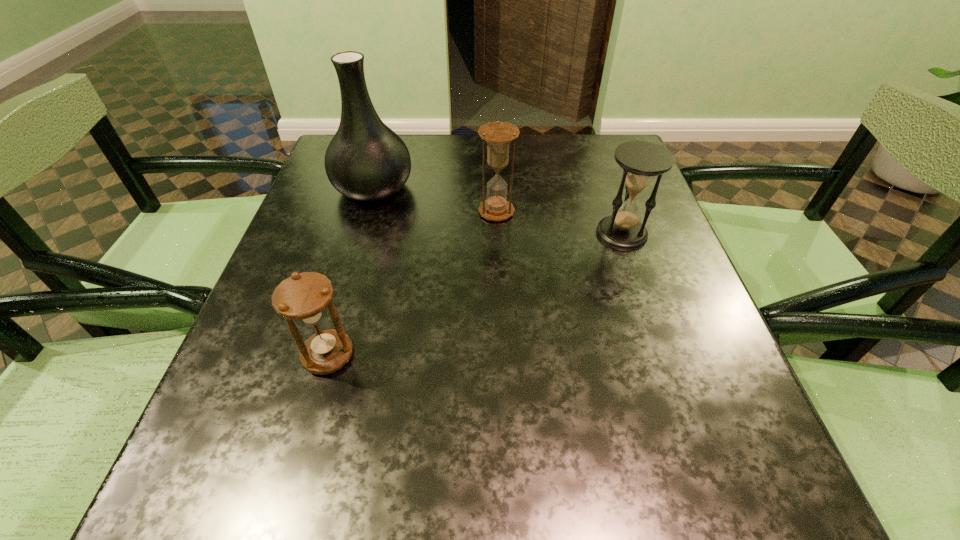
Identify which hourglass is the nearest to the vase. Please provide its 2D coordinates. Your answer should be formatted as a tuple, i.e. [(x, y)], where the tuple contains the x and y coordinates of a point satisfying the conditions above.

[(498, 135)]

Image resolution: width=960 pixels, height=540 pixels. Find the location of `hourglass that is the second closest to the second object from right to left`. hourglass that is the second closest to the second object from right to left is located at coordinates (304, 297).

You are a GUI agent. You are given a task and a screenshot of the screen. Output one action in this format:
    pyautogui.click(x=<x>, y=<y>)
    Task: Click on the free point that satisfies the following two spatial constraints: 1. on the front side of the second object from right to left; 2. on the right side of the rightmost object
    Image resolution: width=960 pixels, height=540 pixels.
    Given the screenshot: What is the action you would take?
    pyautogui.click(x=497, y=233)

Where is `vacant region that satisfies the following two spatial constraints: 1. on the back side of the rightmost hourglass; 2. on the right side of the leftmost hourglass`? The width and height of the screenshot is (960, 540). vacant region that satisfies the following two spatial constraints: 1. on the back side of the rightmost hourglass; 2. on the right side of the leftmost hourglass is located at coordinates (363, 233).